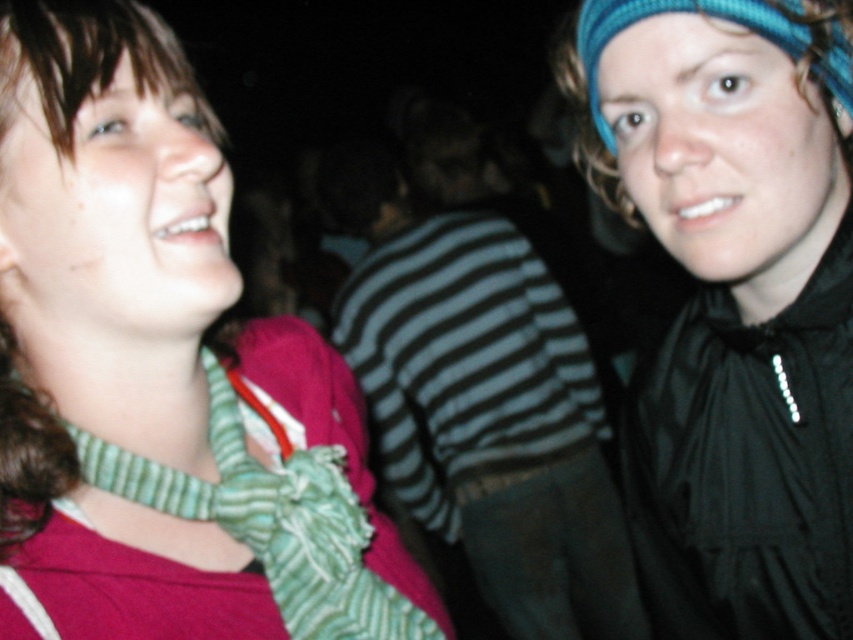
Question: Which object is positioned farthest from the green striped scarf at left?

Choices:
 (A) green striped bow tie at left
 (B) striped fabric shirt at center

Answer: (B)

Question: Observing the image, what is the correct spatial positioning of striped fabric shirt at center in reference to blue knitted headscarf at upper right?

Choices:
 (A) below
 (B) above

Answer: (A)

Question: Is green striped bow tie at left thinner than blue knitted headband at upper right?

Choices:
 (A) yes
 (B) no

Answer: (B)

Question: Which of the following is the closest to the observer?

Choices:
 (A) blue knitted headband at upper right
 (B) blue knitted headscarf at upper right

Answer: (B)

Question: Among these objects, which one is nearest to the camera?

Choices:
 (A) striped fabric shirt at center
 (B) green striped bow tie at left
 (C) green striped scarf at left
 (D) blue knitted headband at upper right

Answer: (B)

Question: Is green striped bow tie at left thinner than blue knitted headband at upper right?

Choices:
 (A) yes
 (B) no

Answer: (B)